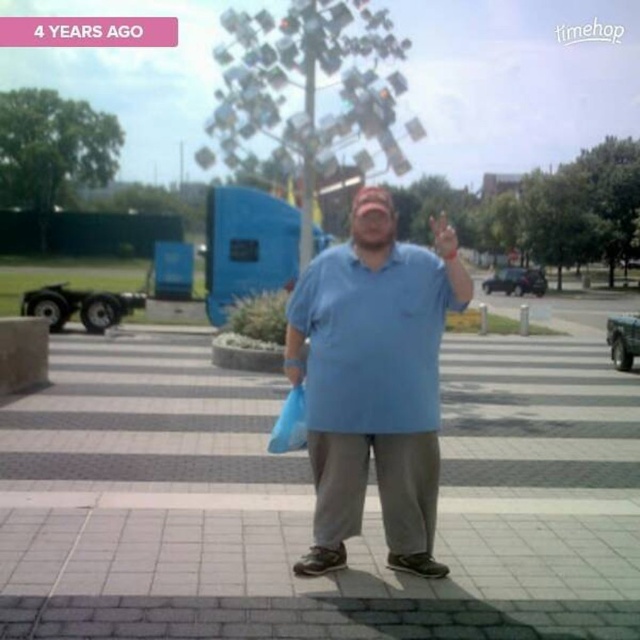
Based on the photo, does blue cotton shirt at center appear under blue cotton polo shirt at center?

No, blue cotton shirt at center is not below blue cotton polo shirt at center.

Is point (291, 317) farther from viewer compared to point (330, 342)?

That is True.

At what (x,y) coordinates should I click in order to perform the action: click on blue cotton shirt at center. Please return your answer as a coordinate pair (x, y). The width and height of the screenshot is (640, 640). Looking at the image, I should click on (372, 384).

Who is positioned more to the left, blue cotton polo shirt at center or blue plastic bag at center?

blue plastic bag at center

Measure the distance from blue cotton polo shirt at center to blue plastic bag at center.

A distance of 19.25 inches exists between blue cotton polo shirt at center and blue plastic bag at center.

Identify the location of blue cotton polo shirt at center. (372, 339).

Can you confirm if blue cotton shirt at center is taller than blue plastic bag at center?

Correct, blue cotton shirt at center is much taller as blue plastic bag at center.

Is blue cotton shirt at center to the right of blue plastic bag at center from the viewer's perspective?

Yes, blue cotton shirt at center is to the right of blue plastic bag at center.

Identify the location of blue cotton shirt at center. (372, 384).